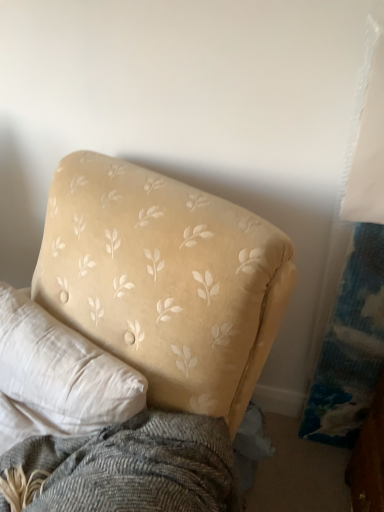
Question: Is velvet yellow couch at upper left positioned behind beige fabric pillow at upper left?

Choices:
 (A) no
 (B) yes

Answer: (A)

Question: Is velvet yellow couch at upper left closer to the viewer compared to beige fabric pillow at upper left?

Choices:
 (A) yes
 (B) no

Answer: (A)

Question: From a real-world perspective, is velvet yellow couch at upper left beneath beige fabric pillow at upper left?

Choices:
 (A) no
 (B) yes

Answer: (B)

Question: Is velvet yellow couch at upper left shorter than beige fabric pillow at upper left?

Choices:
 (A) yes
 (B) no

Answer: (B)

Question: Does velvet yellow couch at upper left appear on the left side of beige fabric pillow at upper left?

Choices:
 (A) no
 (B) yes

Answer: (A)

Question: Is velvet yellow couch at upper left outside beige fabric pillow at upper left?

Choices:
 (A) no
 (B) yes

Answer: (B)

Question: From the image's perspective, does beige fabric pillow at upper left appear lower than velvet yellow couch at upper left?

Choices:
 (A) no
 (B) yes

Answer: (A)

Question: Can you confirm if beige fabric pillow at upper left is taller than velvet yellow couch at upper left?

Choices:
 (A) no
 (B) yes

Answer: (A)

Question: From a real-world perspective, is beige fabric pillow at upper left positioned over velvet yellow couch at upper left based on gravity?

Choices:
 (A) yes
 (B) no

Answer: (A)

Question: Considering the relative sizes of beige fabric pillow at upper left and velvet yellow couch at upper left in the image provided, is beige fabric pillow at upper left shorter than velvet yellow couch at upper left?

Choices:
 (A) yes
 (B) no

Answer: (A)

Question: Is beige fabric pillow at upper left far away from velvet yellow couch at upper left?

Choices:
 (A) no
 (B) yes

Answer: (A)

Question: Is beige fabric pillow at upper left to the right of velvet yellow couch at upper left from the viewer's perspective?

Choices:
 (A) yes
 (B) no

Answer: (B)

Question: Considering their positions, is velvet yellow couch at upper left located in front of or behind beige fabric pillow at upper left?

Choices:
 (A) behind
 (B) front

Answer: (B)